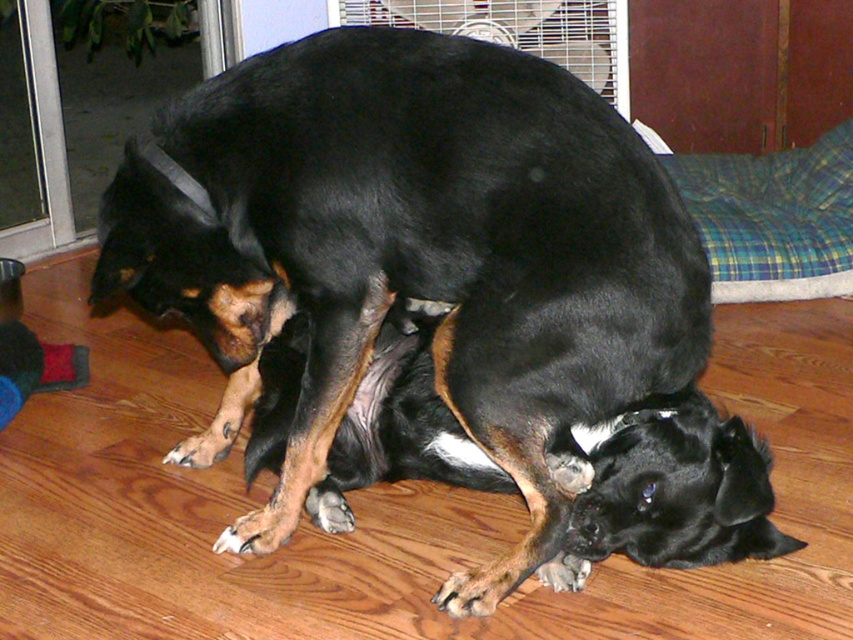
Based on the photo, can you confirm if black smooth dog at center is bigger than plaid fabric dog bed at upper right?

Yes, black smooth dog at center is bigger than plaid fabric dog bed at upper right.

Measure the distance between black smooth dog at center and plaid fabric dog bed at upper right.

black smooth dog at center and plaid fabric dog bed at upper right are 1.40 meters apart.

Describe the element at coordinates (415, 256) in the screenshot. The width and height of the screenshot is (853, 640). I see `black smooth dog at center` at that location.

In order to click on black smooth dog at center in this screenshot , I will do tap(415, 256).